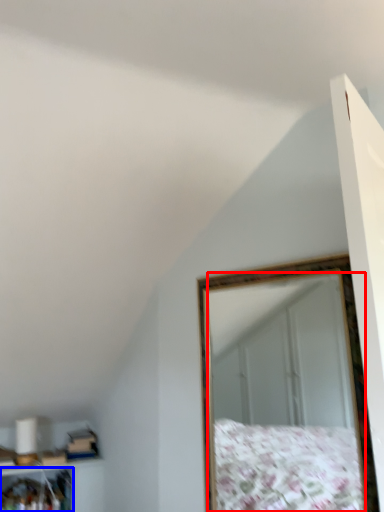
Question: Which point is closer to the camera, mirror (highlighted by a red box) or cabinet (highlighted by a blue box)?

Choices:
 (A) mirror
 (B) cabinet

Answer: (A)